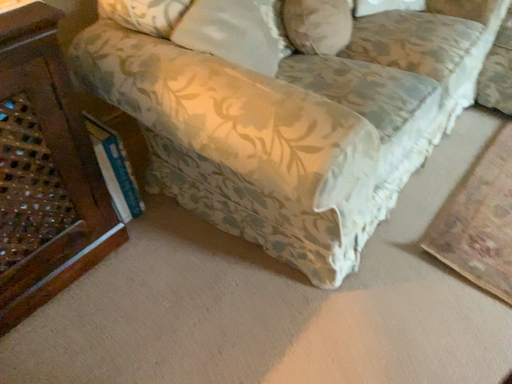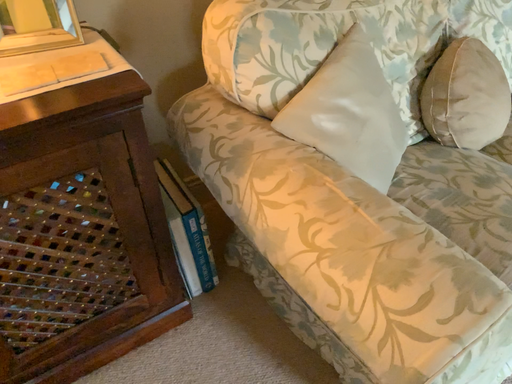
Question: Which way did the camera rotate in the video?

Choices:
 (A) rotated right
 (B) rotated left

Answer: (B)